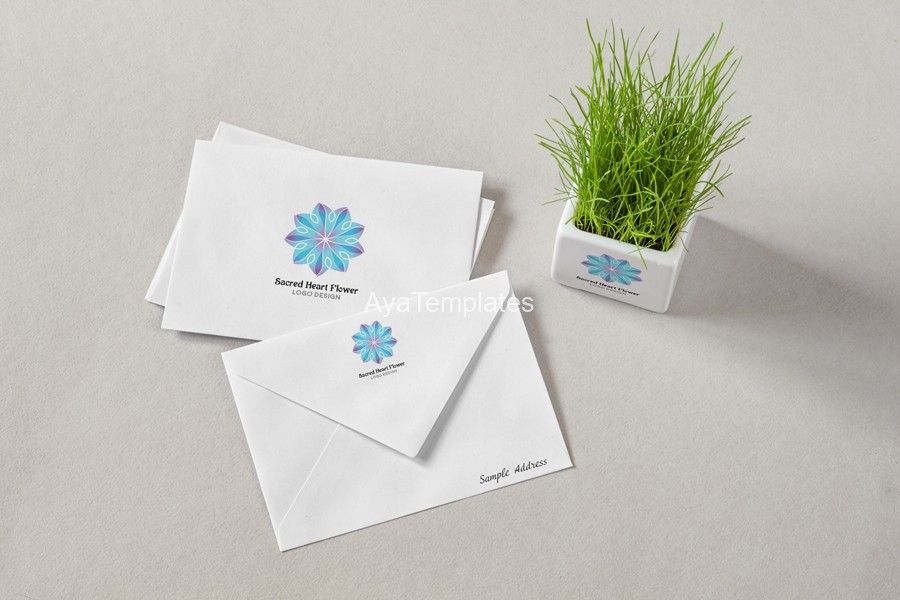
Where is `green grass plant`? The image size is (900, 600). green grass plant is located at coordinates (642, 181).